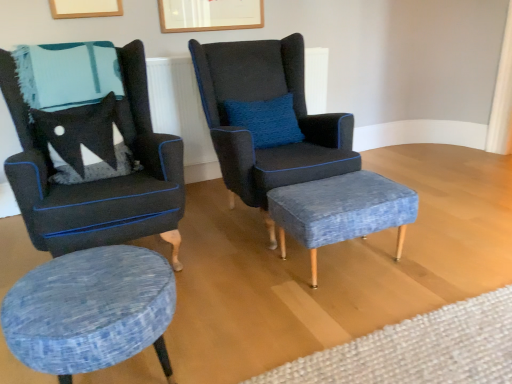
Locate an element on the screen. empty space that is to the right of velvet dark blue armchair at center, the 2th chair when ordered from left to right is located at coordinates coord(438,226).